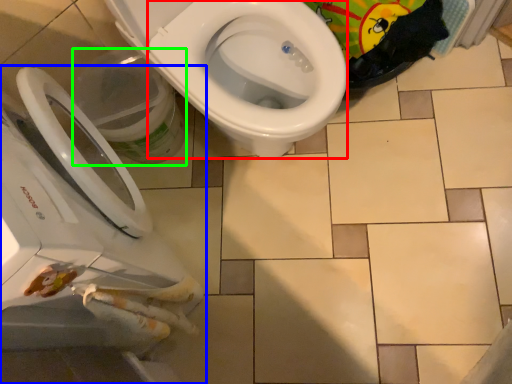
Question: Considering the real-world distances, which object is closest to bidet (highlighted by a red box)? toilet (highlighted by a blue box) or potty (highlighted by a green box).

Choices:
 (A) toilet
 (B) potty

Answer: (B)